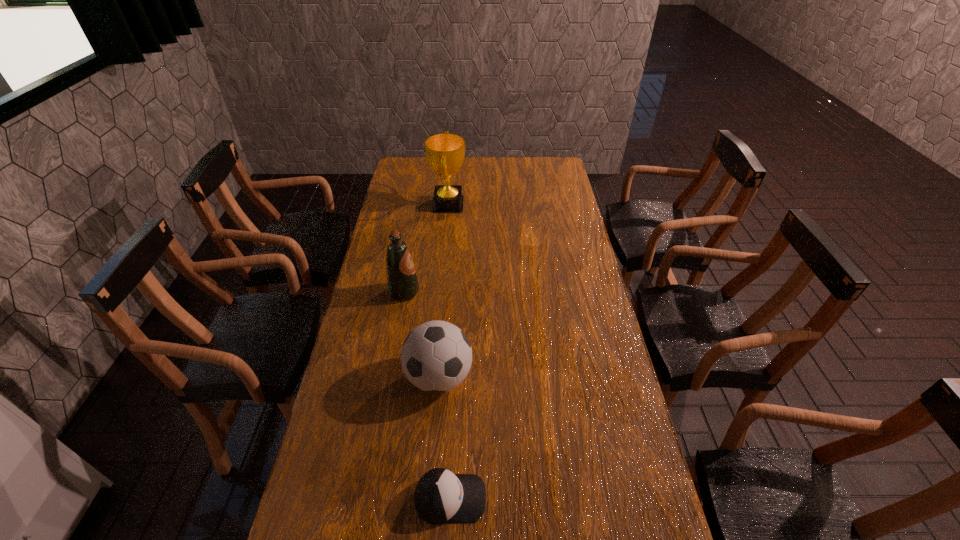
You are a GUI agent. You are given a task and a screenshot of the screen. Output one action in this format:
    pyautogui.click(x=<x>, y=<y>)
    Task: Click on the award
    Image resolution: width=960 pixels, height=540 pixels.
    Given the screenshot: What is the action you would take?
    pyautogui.click(x=445, y=152)

Find the location of a particular element. The image size is (960, 540). olive oil is located at coordinates (402, 282).

Find the location of a particular element. The image size is (960, 540). soccer ball is located at coordinates (436, 356).

At what (x,y) coordinates should I click in order to perform the action: click on the third farthest object. Please return your answer as a coordinate pair (x, y). This screenshot has height=540, width=960. Looking at the image, I should click on (436, 356).

Locate an element on the screen. The height and width of the screenshot is (540, 960). the nearest object is located at coordinates (440, 496).

Identify the location of cap. (440, 496).

Where is `vacant space located 0.260m on the front-facing side of the award`? The width and height of the screenshot is (960, 540). vacant space located 0.260m on the front-facing side of the award is located at coordinates (523, 205).

Where is `free region located 0.120m on the front-facing side of the olive oil`? Image resolution: width=960 pixels, height=540 pixels. free region located 0.120m on the front-facing side of the olive oil is located at coordinates (452, 292).

You are a GUI agent. You are given a task and a screenshot of the screen. Output one action in this format:
    pyautogui.click(x=<x>, y=<y>)
    Task: Click on the vacant region located 0.100m on the left of the soccer ball
    This screenshot has height=540, width=960.
    Given the screenshot: What is the action you would take?
    pyautogui.click(x=372, y=377)

Where is `blank space located on the front panel of the cap`? The width and height of the screenshot is (960, 540). blank space located on the front panel of the cap is located at coordinates pyautogui.click(x=579, y=498).